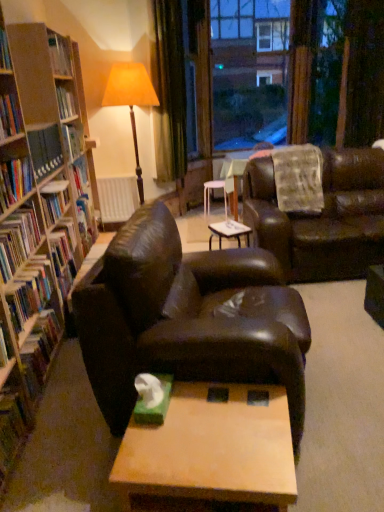
Question: Considering the relative sizes of transparent glass window at upper center and green matte tissue box at center in the image provided, is transparent glass window at upper center taller than green matte tissue box at center?

Choices:
 (A) yes
 (B) no

Answer: (A)

Question: From a real-world perspective, is transparent glass window at upper center physically below green matte tissue box at center?

Choices:
 (A) no
 (B) yes

Answer: (A)

Question: Can you confirm if transparent glass window at upper center is thinner than green matte tissue box at center?

Choices:
 (A) yes
 (B) no

Answer: (B)

Question: Are transparent glass window at upper center and green matte tissue box at center beside each other?

Choices:
 (A) yes
 (B) no

Answer: (B)

Question: Is transparent glass window at upper center outside green matte tissue box at center?

Choices:
 (A) yes
 (B) no

Answer: (A)

Question: Are transparent glass window at upper center and green matte tissue box at center located far from each other?

Choices:
 (A) no
 (B) yes

Answer: (B)

Question: Is hardcover book at left, the 4th book from the top, oriented towards hardcover book at left, the 6th book in the bottom-to-top sequence?

Choices:
 (A) no
 (B) yes

Answer: (A)

Question: Is hardcover book at left, the 4th book from the top, to the right of hardcover book at left, which ranks as the 2th book in top-to-bottom order, from the viewer's perspective?

Choices:
 (A) yes
 (B) no

Answer: (A)

Question: Is hardcover book at left, the 6th book in the bottom-to-top sequence, a part of hardcover book at left, the 4th book from the bottom?

Choices:
 (A) yes
 (B) no

Answer: (B)

Question: Considering the relative sizes of hardcover book at left, the 4th book from the top, and hardcover book at left, which ranks as the 2th book in top-to-bottom order, in the image provided, is hardcover book at left, the 4th book from the top, bigger than hardcover book at left, which ranks as the 2th book in top-to-bottom order,?

Choices:
 (A) no
 (B) yes

Answer: (B)

Question: Is hardcover book at left, the 4th book from the bottom, to the left of hardcover book at left, the 6th book in the bottom-to-top sequence, from the viewer's perspective?

Choices:
 (A) yes
 (B) no

Answer: (B)

Question: From a real-world perspective, is hardcover book at left, the 4th book from the bottom, below hardcover book at left, the 6th book in the bottom-to-top sequence?

Choices:
 (A) yes
 (B) no

Answer: (A)

Question: From a real-world perspective, is white matte radiator at center on top of leather couch at center, placed as the second studio couch when sorted from left to right?

Choices:
 (A) no
 (B) yes

Answer: (A)